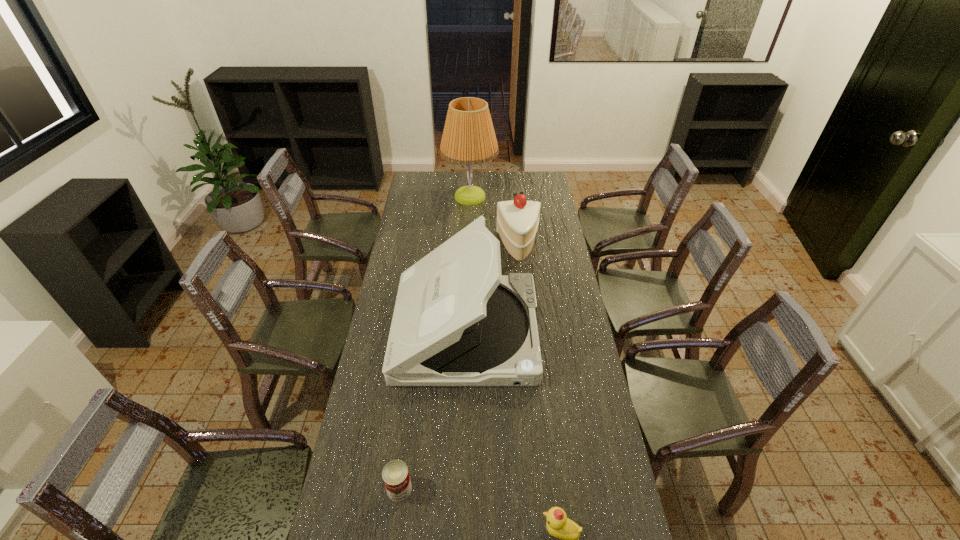
In order to click on the third closest object to the tallest object in this screenshot , I will do `click(395, 474)`.

Identify the location of the third closest object to the CD player. Image resolution: width=960 pixels, height=540 pixels. (558, 525).

The height and width of the screenshot is (540, 960). I want to click on free spot that satisfies the following two spatial constraints: 1. on the back side of the third tallest object; 2. on the side of the tallest object near the pull switch, so click(514, 197).